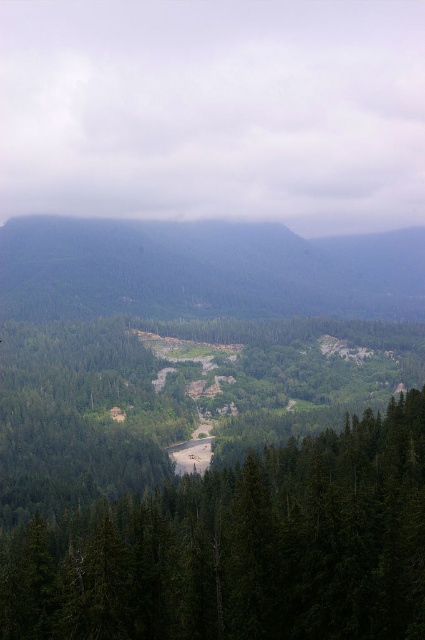
Question: Which point is closer to the camera?

Choices:
 (A) green matte tree at center
 (B) green forested hillside at center

Answer: (A)

Question: Can you confirm if green matte tree at center is positioned below green forested hillside at center?

Choices:
 (A) no
 (B) yes

Answer: (B)

Question: Is green matte tree at center further to the viewer compared to green forested hillside at center?

Choices:
 (A) yes
 (B) no

Answer: (B)

Question: Is green matte tree at center thinner than green forested hillside at center?

Choices:
 (A) yes
 (B) no

Answer: (A)